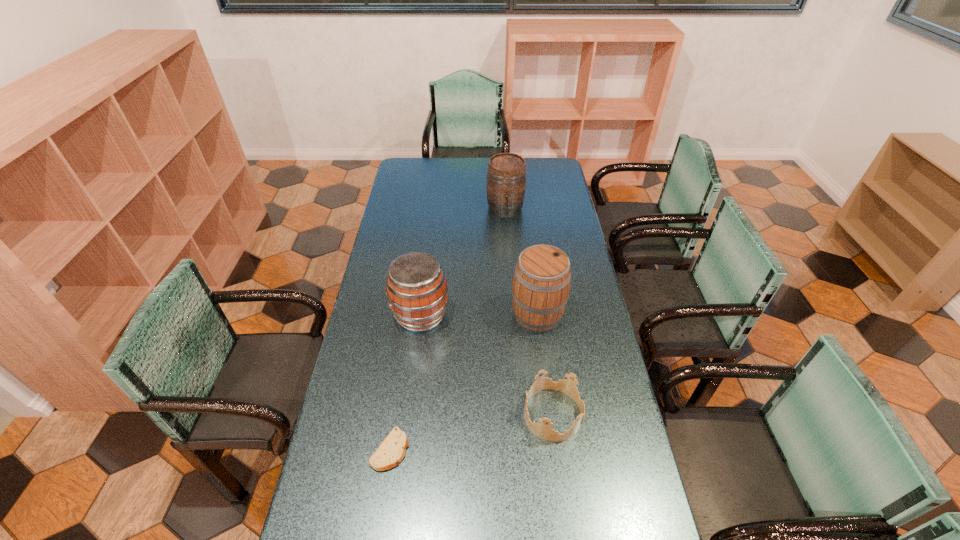
At what (x,y) coordinates should I click in order to perform the action: click on the farthest object. Please return your answer as a coordinate pair (x, y). Image resolution: width=960 pixels, height=540 pixels. Looking at the image, I should click on (506, 177).

The height and width of the screenshot is (540, 960). What are the coordinates of `the leftmost cider` in the screenshot? It's located at (416, 287).

Where is `the second shortest object`? the second shortest object is located at coordinates (542, 430).

Identify the location of pita bread. (391, 451).

The height and width of the screenshot is (540, 960). Find the location of `free spot located 0.060m on the side of the farthest cider near the bung hole`. free spot located 0.060m on the side of the farthest cider near the bung hole is located at coordinates click(x=507, y=227).

Image resolution: width=960 pixels, height=540 pixels. I want to click on vacant area situated on the back of the leftmost cider, so click(431, 232).

At what (x,y) coordinates should I click in order to perform the action: click on free space located 0.090m on the front-facing side of the tiara. Please return your answer as a coordinate pair (x, y). This screenshot has width=960, height=540. Looking at the image, I should click on (494, 414).

The image size is (960, 540). Identify the location of vacant point located 0.120m on the front-facing side of the tiara. (485, 414).

Where is `free location located on the front-facing side of the tiara`? This screenshot has width=960, height=540. free location located on the front-facing side of the tiara is located at coordinates (492, 414).

At what (x,y) coordinates should I click in order to perform the action: click on vacant area situated on the back of the pita bread. Please return your answer as a coordinate pair (x, y). This screenshot has height=540, width=960. Looking at the image, I should click on (406, 346).